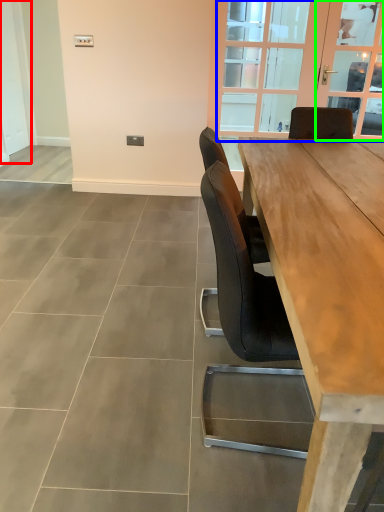
Question: Which object is positioned closest to screen door (highlighted by a red box)? Select from window (highlighted by a blue box) and window screen (highlighted by a green box).

Choices:
 (A) window
 (B) window screen

Answer: (A)